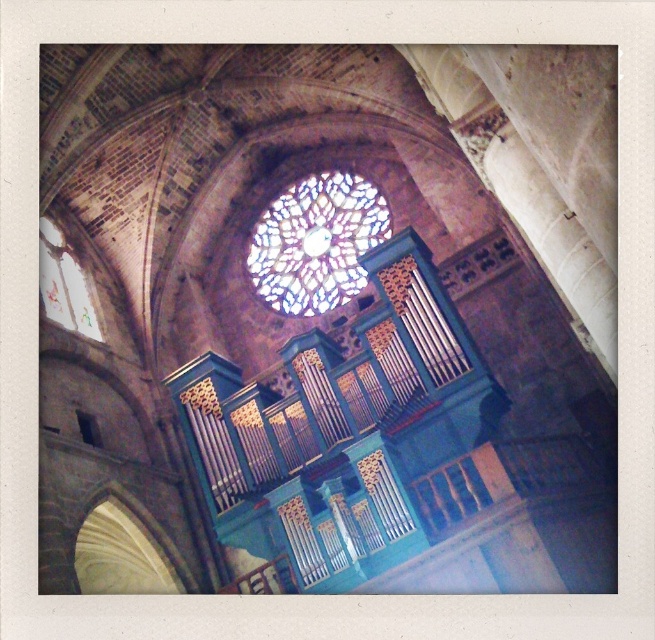
You are standing inside the cathedral and want to take a photo of both the stained glass window at center and the translucent stained glass at upper left. Which one will appear larger in your camera viewfinder?

The stained glass window at center will appear larger in the camera viewfinder because it is closer to you than the translucent stained glass at upper left.

You are an architect visiting the cathedral and want to compare the sizes of the stained glass window at center and the translucent stained glass at upper left. Which one is bigger?

The stained glass window at center is larger in size than the translucent stained glass at upper left.